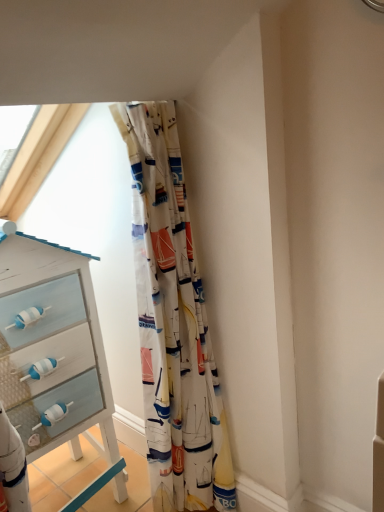
Identify the location of vacant space situated above printed fabric curtain at center (from a real-world perspective). (146, 102).